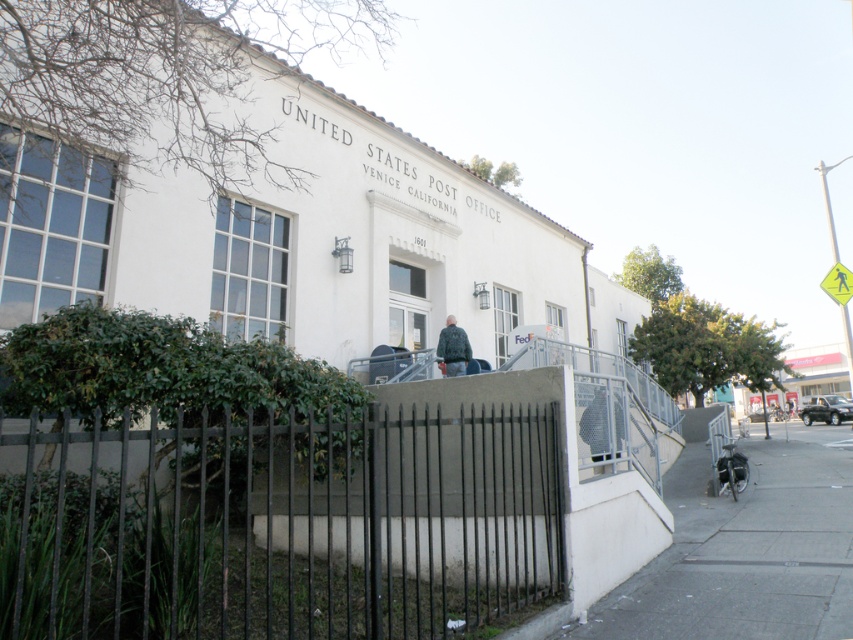
Question: In this image, where is gray concrete sidewalk at lower right located relative to yellow reflective plastic pedestrian crossing sign at upper right?

Choices:
 (A) above
 (B) below

Answer: (B)

Question: Which object is farther from the camera taking this photo?

Choices:
 (A) gray concrete sidewalk at lower right
 (B) black metal fence at lower center
 (C) leather jacket at center

Answer: (C)

Question: Which point is closer to the camera taking this photo?

Choices:
 (A) (457, 346)
 (B) (836, 260)
 (C) (57, 509)
 (D) (751, 548)

Answer: (C)

Question: Considering the real-world distances, which object is farthest from the leather jacket at center?

Choices:
 (A) gray concrete sidewalk at lower right
 (B) yellow reflective plastic pedestrian crossing sign at upper right
 (C) black metal fence at lower center

Answer: (B)

Question: Is leather jacket at center bigger than yellow reflective plastic pedestrian crossing sign at upper right?

Choices:
 (A) no
 (B) yes

Answer: (A)

Question: Is leather jacket at center positioned at the back of yellow reflective plastic pedestrian crossing sign at upper right?

Choices:
 (A) yes
 (B) no

Answer: (B)